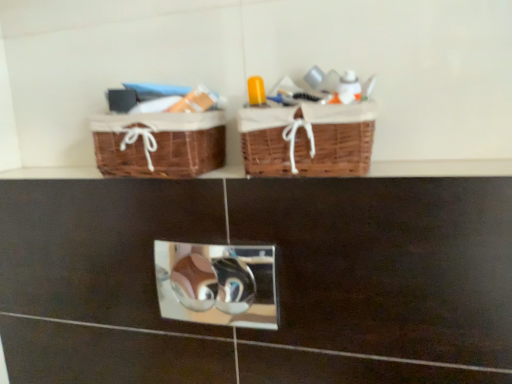
Identify the location of empty space that is ontop of woven brown picnic basket at upper center, which is the 2th picnic basket from left to right (from a real-world perspective). (313, 98).